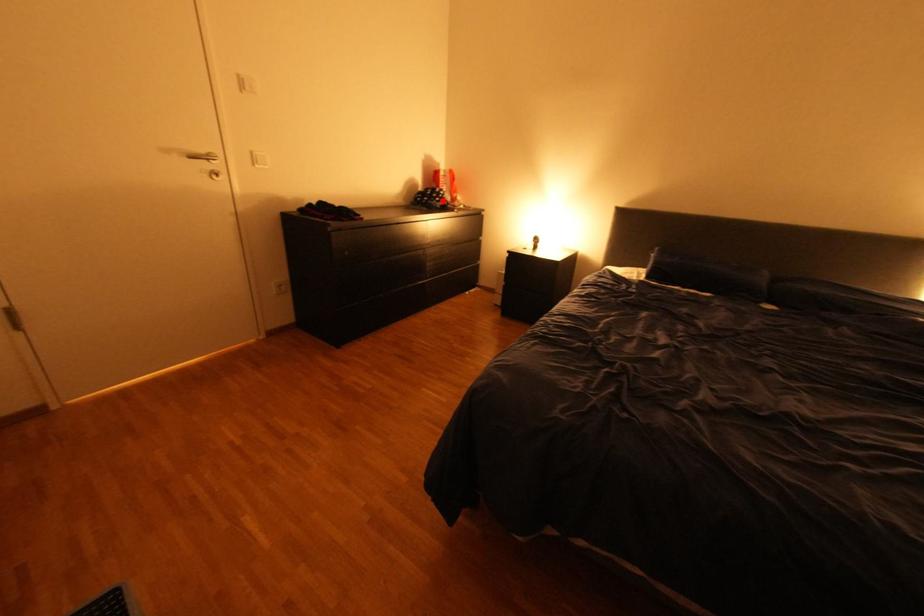
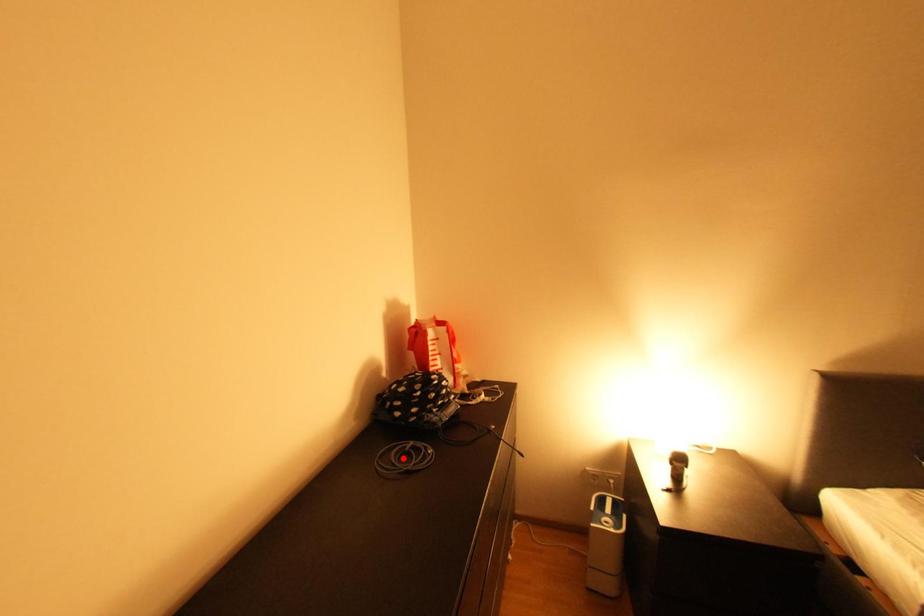
I am providing you with two images of the same scene from different viewpoints. A red point is marked on the first image and another point is marked on the second image. Does the point marked in image1 correspond to the same location as the one in image2?

No